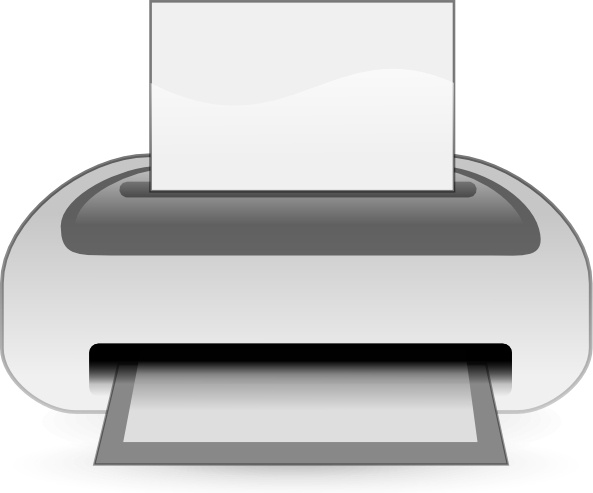
At what (x,y) coordinates should I click in order to perform the action: click on printer. Please return your answer as a coordinate pair (x, y). Looking at the image, I should click on (538, 308).